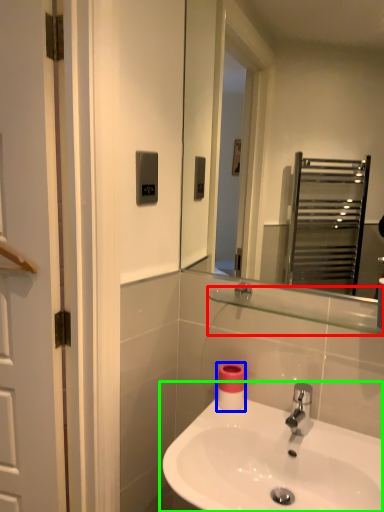
Question: Based on their relative distances, which object is farther from balustrade (highlighted by a red box)? Choose from toilet paper (highlighted by a blue box) and sink (highlighted by a green box).

Choices:
 (A) toilet paper
 (B) sink

Answer: (B)